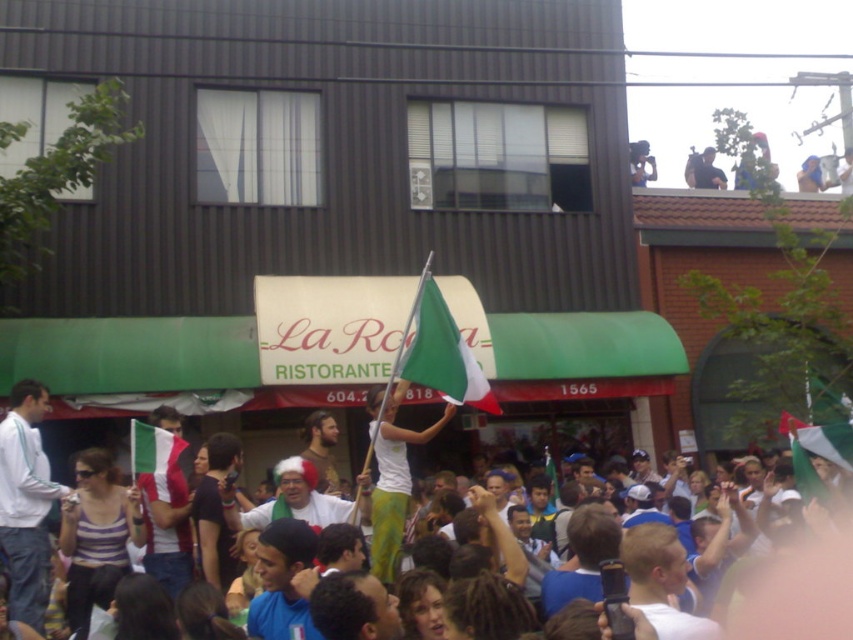
You are a photographer at the event and want to capture the green fabric flag at center and the metallic silver camera at upper right in your photo. Which object appears narrower in the photo?

The green fabric flag at center is thinner than the metallic silver camera at upper right, so it will appear narrower in the photo.